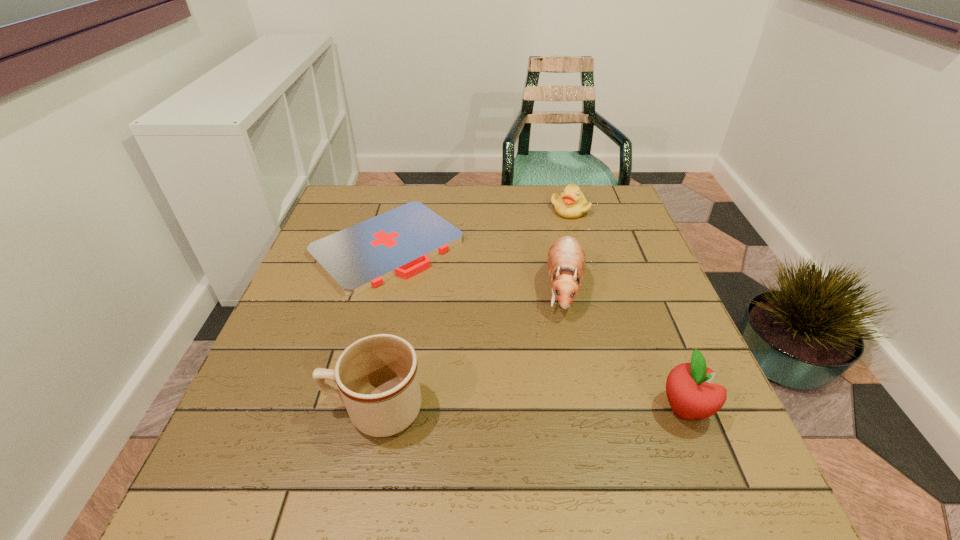
Find the location of a particular element. This screenshot has height=540, width=960. vacant space at the right edge of the desktop is located at coordinates (635, 251).

At what (x,y) coordinates should I click in order to perform the action: click on vacant space at the far left corner. Please return your answer as a coordinate pair (x, y). The image size is (960, 540). Looking at the image, I should click on (361, 210).

At what (x,y) coordinates should I click in order to perform the action: click on vacant space in between the mug and the first-aid kit. Please return your answer as a coordinate pair (x, y). Looking at the image, I should click on (381, 328).

Where is `blank region between the shortest object and the apple`? blank region between the shortest object and the apple is located at coordinates tap(536, 327).

Identify the location of free spot between the mug and the shortest object. (381, 328).

This screenshot has width=960, height=540. Identify the location of free point between the mug and the rightmost object. (530, 409).

I want to click on vacant point located between the duckling and the apple, so click(x=627, y=309).

This screenshot has height=540, width=960. What are the coordinates of `vacant space that's between the shortest object and the rightmost object` in the screenshot? It's located at (536, 327).

Find the location of a particular element. free space between the fourth tallest object and the mug is located at coordinates (472, 309).

Find the location of a particular element. The width and height of the screenshot is (960, 540). free area in between the rightmost object and the second shortest object is located at coordinates (627, 309).